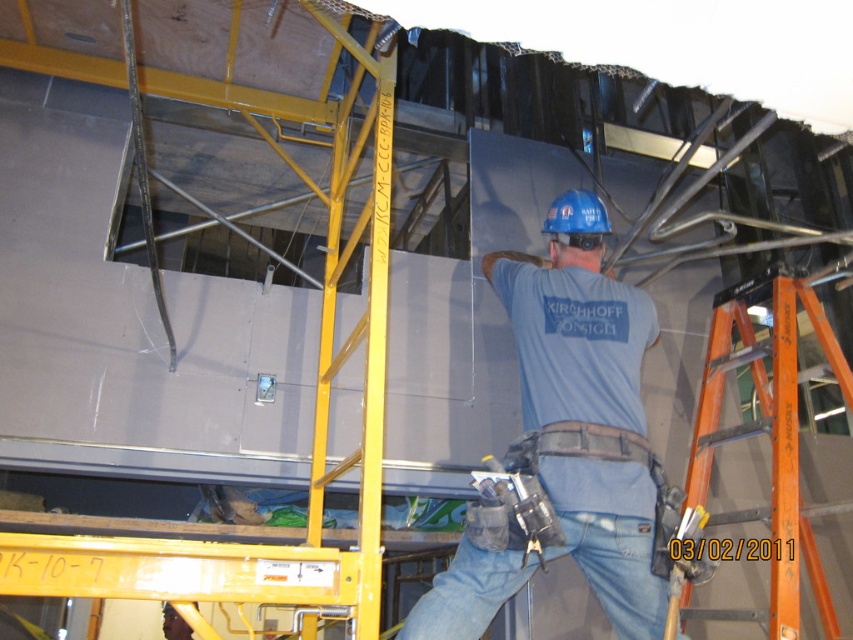
Is point (25, 61) in front of point (593, 557)?

No.

Is orange metal ladder at upper center above jeans at center?

Indeed, orange metal ladder at upper center is positioned over jeans at center.

Is point (187, 77) positioned after point (601, 520)?

Yes, point (187, 77) is farther from viewer.

Where is `orange metal ladder at upper center`? The height and width of the screenshot is (640, 853). orange metal ladder at upper center is located at coordinates (323, 260).

Can you confirm if blue hard hat at center is positioned to the left of orange fiberglass ladder at right?

Correct, you'll find blue hard hat at center to the left of orange fiberglass ladder at right.

Which is behind, point (581, 499) or point (811, 547)?

The point (811, 547) is behind.

The image size is (853, 640). I want to click on blue hard hat at center, so click(x=573, y=323).

Is blue hard hat at center to the right of jeans at center from the viewer's perspective?

Yes, blue hard hat at center is to the right of jeans at center.

Between point (614, 376) and point (416, 602), which one is positioned behind?

Positioned behind is point (614, 376).

Which is in front, point (560, 204) or point (618, 529)?

Point (618, 529) is more forward.

Find the location of `blue hard hat at center`. blue hard hat at center is located at coordinates (573, 323).